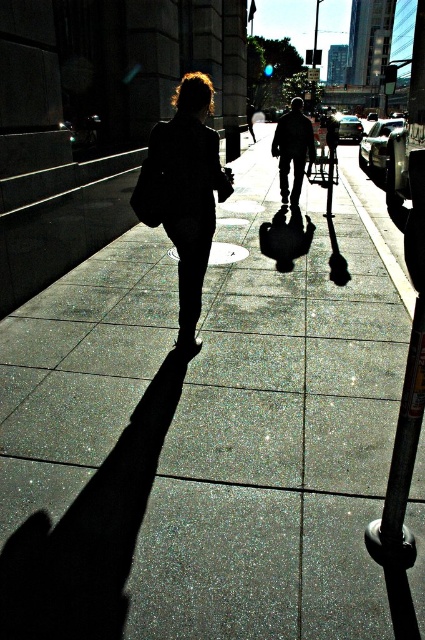
In the scene shown: Does black matte jacket at center appear over dark textured jacket at center?

Actually, black matte jacket at center is below dark textured jacket at center.

Looking at this image, is black matte jacket at center smaller than dark textured jacket at center?

Yes.

What do you see at coordinates (184, 193) in the screenshot?
I see `black matte jacket at center` at bounding box center [184, 193].

Image resolution: width=425 pixels, height=640 pixels. Find the location of `black matte jacket at center`. black matte jacket at center is located at coordinates (184, 193).

Does black matte jacket at center have a smaller size compared to metallic gray parking meter at center-right?

Correct, black matte jacket at center occupies less space than metallic gray parking meter at center-right.

Find the location of a particular element. This screenshot has height=640, width=425. black matte jacket at center is located at coordinates (184, 193).

Describe the element at coordinates (292, 148) in the screenshot. The height and width of the screenshot is (640, 425). I see `dark textured jacket at center` at that location.

Is dark textured jacket at center wider than metallic gray parking meter at center-right?

No, dark textured jacket at center is not wider than metallic gray parking meter at center-right.

Image resolution: width=425 pixels, height=640 pixels. What are the coordinates of `dark textured jacket at center` in the screenshot? It's located at (292, 148).

Image resolution: width=425 pixels, height=640 pixels. I want to click on dark textured jacket at center, so click(292, 148).